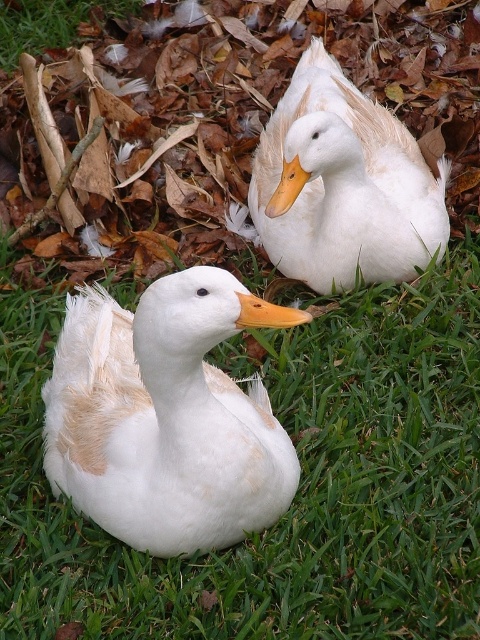
Question: Among these points, which one is nearest to the camera?

Choices:
 (A) (263, 534)
 (B) (377, 244)
 (C) (208, 275)

Answer: (C)

Question: Can you confirm if green grass at center is positioned above white matte duck at center?

Choices:
 (A) no
 (B) yes

Answer: (A)

Question: Considering the real-world distances, which object is closest to the green grass at center?

Choices:
 (A) orange matte beak at center
 (B) white matte duck at center

Answer: (B)

Question: Is green grass at center positioned in front of white matte duck at center?

Choices:
 (A) yes
 (B) no

Answer: (A)

Question: Does white matte duck at center have a smaller size compared to orange matte beak at upper center?

Choices:
 (A) yes
 (B) no

Answer: (B)

Question: Estimate the real-world distances between objects in this image. Which object is farther from the white fluffy duck at center?

Choices:
 (A) green grass at center
 (B) orange matte beak at center

Answer: (B)